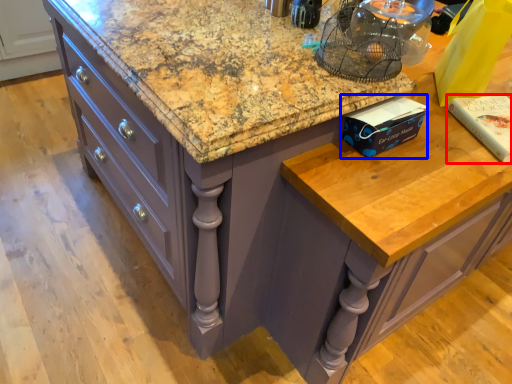
Question: Among these objects, which one is farthest to the camera, book (highlighted by a red box) or book (highlighted by a blue box)?

Choices:
 (A) book
 (B) book

Answer: (A)